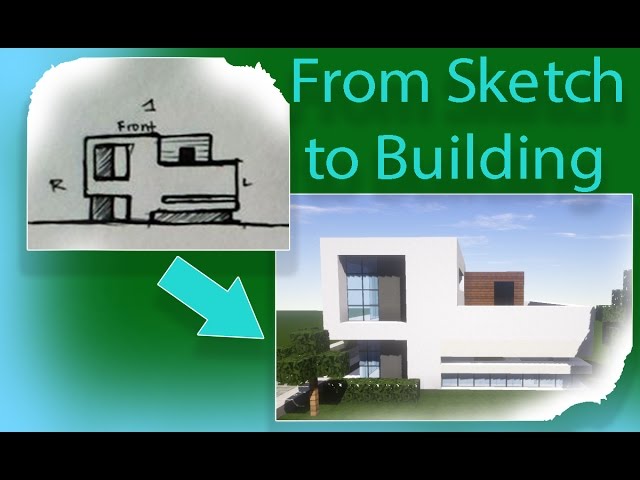
This screenshot has width=640, height=480. Identify the location of door. (505, 297).